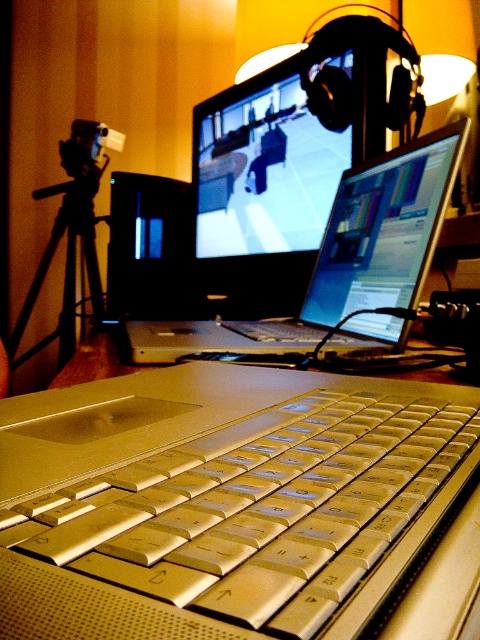
Is silver metallic laptop at center bigger than black matte tripod at left?

Incorrect, silver metallic laptop at center is not larger than black matte tripod at left.

Is point (326, 260) positioned before point (66, 342)?

Yes, point (326, 260) is in front of point (66, 342).

This screenshot has height=640, width=480. Identify the location of silver metallic laptop at center. (340, 257).

Is silver metallic keyboard at center shorter than silver plastic video camera at left?

Indeed, silver metallic keyboard at center has a lesser height compared to silver plastic video camera at left.

Does silver metallic keyboard at center lie behind silver plastic video camera at left?

No, silver metallic keyboard at center is in front of silver plastic video camera at left.

In order to click on silver metallic keyboard at center in this screenshot , I will do `click(223, 500)`.

Locate an element on the screen. The image size is (480, 640). silver metallic keyboard at center is located at coordinates (223, 500).

Between silver metallic laptop at center and silver plastic video camera at left, which one has more height?

silver metallic laptop at center is taller.

Find the location of `silver metallic laptop at center`. silver metallic laptop at center is located at coordinates (340, 257).

Find the location of a particular element. silver metallic laptop at center is located at coordinates (340, 257).